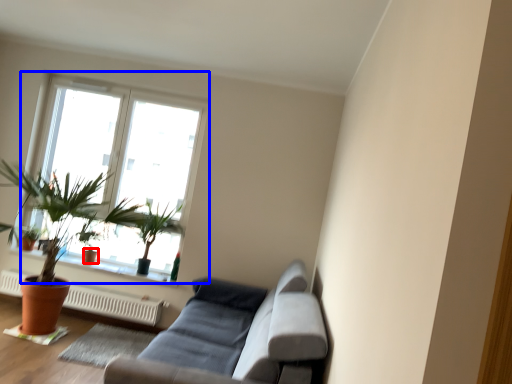
Question: Which object is further to the camera taking this photo, flowerpot (highlighted by a red box) or window (highlighted by a blue box)?

Choices:
 (A) flowerpot
 (B) window

Answer: (A)